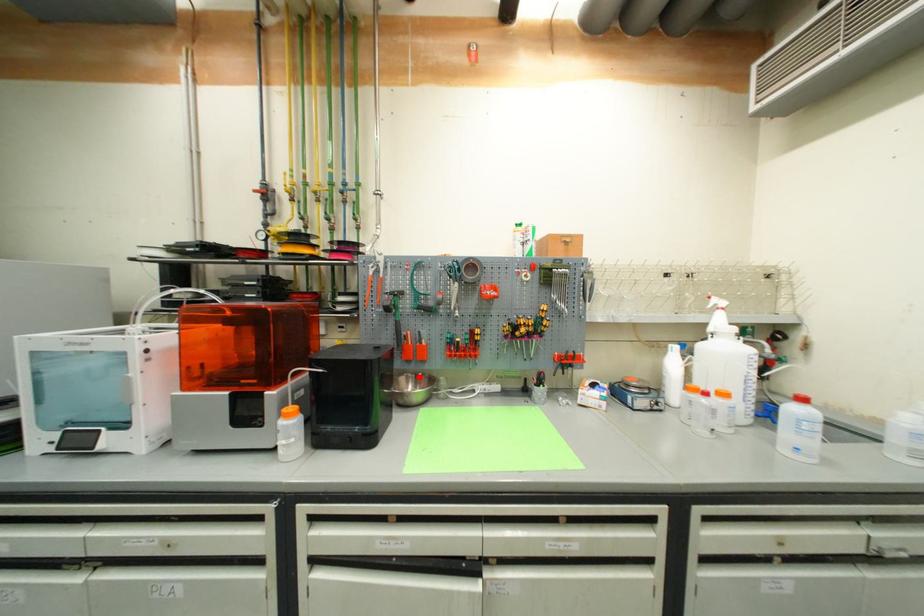
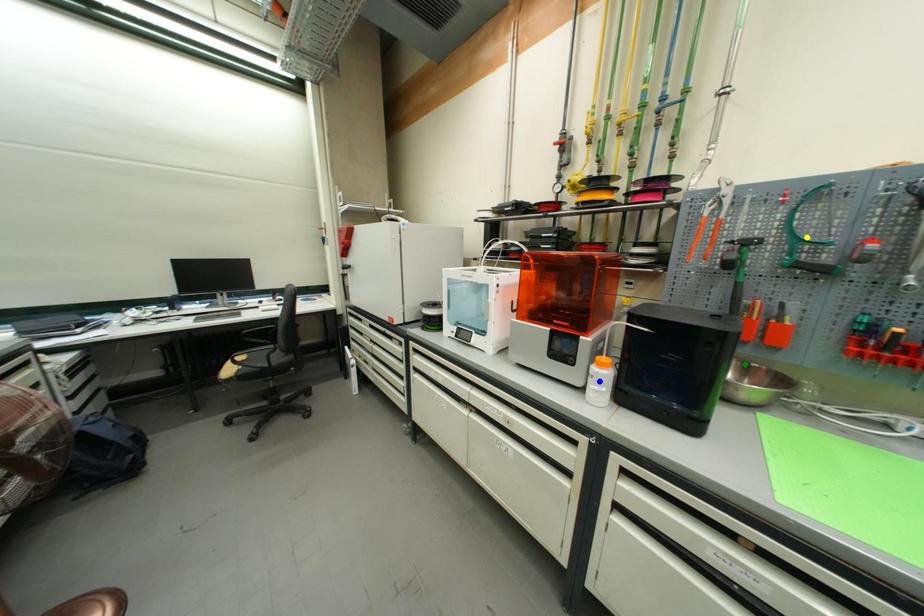
Question: I am providing you with two images of the same scene from different viewpoints. A red point is marked on the first image. You are given multiple points on the second image. Which point in image 2 is actually the same real-world point as the red point in image 1?

Choices:
 (A) green point
 (B) yellow point
 (C) blue point

Answer: (A)